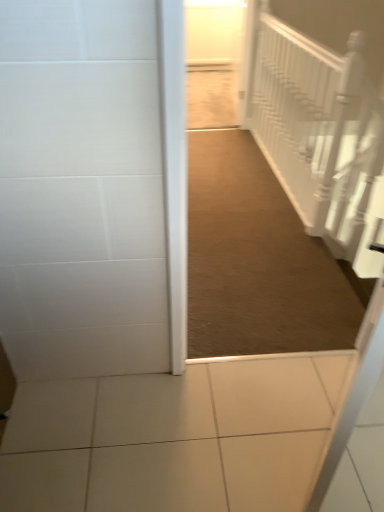
Describe the element at coordinates (258, 260) in the screenshot. I see `brown carpet at center` at that location.

You are a GUI agent. You are given a task and a screenshot of the screen. Output one action in this format:
    pyautogui.click(x=<x>, y=<y>)
    Task: Click on the brown carpet at center
    This screenshot has height=512, width=384.
    Given the screenshot: What is the action you would take?
    pyautogui.click(x=258, y=260)

This screenshot has width=384, height=512. Describe the element at coordinates (319, 133) in the screenshot. I see `white textured stairwell at upper right` at that location.

This screenshot has height=512, width=384. I want to click on white textured stairwell at upper right, so click(x=319, y=133).

Identify the location of brown carpet at center. The height and width of the screenshot is (512, 384). (258, 260).

Can you confirm if white textured stairwell at upper right is positioned to the right of brown carpet at center?

Yes.

Does white textured stairwell at upper right lie in front of brown carpet at center?

No, the depth of white textured stairwell at upper right is greater than that of brown carpet at center.

Is point (263, 102) positioned before point (220, 339)?

No, it is not.

From the image's perspective, is white textured stairwell at upper right located beneath brown carpet at center?

No.

From a real-world perspective, is white textured stairwell at upper right positioned over brown carpet at center based on gravity?

Yes, from a real-world perspective, white textured stairwell at upper right is above brown carpet at center.

Between white textured stairwell at upper right and brown carpet at center, which one has smaller width?

white textured stairwell at upper right.

Considering the relative sizes of white textured stairwell at upper right and brown carpet at center in the image provided, is white textured stairwell at upper right taller than brown carpet at center?

Correct, white textured stairwell at upper right is much taller as brown carpet at center.

Between white textured stairwell at upper right and brown carpet at center, which one has smaller size?

brown carpet at center.

Can we say white textured stairwell at upper right lies outside brown carpet at center?

That's correct, white textured stairwell at upper right is outside of brown carpet at center.

Can you see white textured stairwell at upper right touching brown carpet at center?

No, white textured stairwell at upper right is not next to brown carpet at center.

Based on the photo, is white textured stairwell at upper right aimed at brown carpet at center?

Yes.

How different are the orientations of white textured stairwell at upper right and brown carpet at center in degrees?

90.8 degrees.

This screenshot has width=384, height=512. What are the coordinates of `path that appears below the white textured stairwell at upper right (from the image's perspective)` in the screenshot? It's located at (258, 260).

Can you confirm if brown carpet at center is positioned to the right of white textured stairwell at upper right?

Incorrect, brown carpet at center is not on the right side of white textured stairwell at upper right.

Does brown carpet at center lie in front of white textured stairwell at upper right?

That is True.

Does point (213, 230) come in front of point (302, 60)?

That is False.

From the image's perspective, which is above, brown carpet at center or white textured stairwell at upper right?

white textured stairwell at upper right is shown above in the image.

From a real-world perspective, which is physically below, brown carpet at center or white textured stairwell at upper right?

brown carpet at center.

Is brown carpet at center wider than white textured stairwell at upper right?

Correct, the width of brown carpet at center exceeds that of white textured stairwell at upper right.

Which of these two, brown carpet at center or white textured stairwell at upper right, stands shorter?

Standing shorter between the two is brown carpet at center.

Between brown carpet at center and white textured stairwell at upper right, which one has smaller size?

Smaller between the two is brown carpet at center.

Is brown carpet at center inside the boundaries of white textured stairwell at upper right, or outside?

brown carpet at center cannot be found inside white textured stairwell at upper right.

From the picture: Is there a large distance between brown carpet at center and white textured stairwell at upper right?

brown carpet at center is actually quite close to white textured stairwell at upper right.

Is brown carpet at center turned away from white textured stairwell at upper right?

That's not correct — brown carpet at center is not looking away from white textured stairwell at upper right.

How many degrees apart are the facing directions of brown carpet at center and white textured stairwell at upper right?

The facing directions of brown carpet at center and white textured stairwell at upper right are 90.8 degrees apart.

Find the location of a particular element. path below the white textured stairwell at upper right (from a real-world perspective) is located at coordinates (258, 260).

At what (x,y) coordinates should I click in order to perform the action: click on stairwell above the brown carpet at center (from a real-world perspective). Please return your answer as a coordinate pair (x, y). This screenshot has width=384, height=512. Looking at the image, I should click on (319, 133).

Locate an element on the screen. The height and width of the screenshot is (512, 384). path in front of the white textured stairwell at upper right is located at coordinates (258, 260).